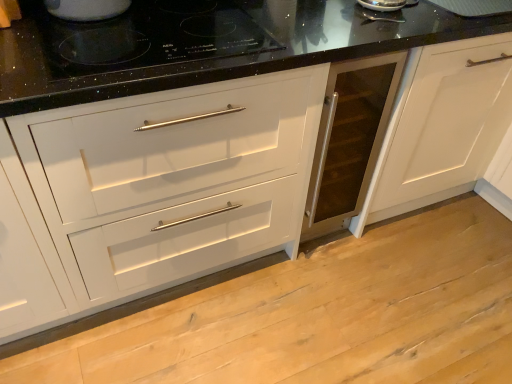
Question: Is black glass cooktop at upper center surrounding white glossy kettle at upper left?

Choices:
 (A) no
 (B) yes

Answer: (A)

Question: From the image's perspective, does black glass cooktop at upper center appear higher than white glossy kettle at upper left?

Choices:
 (A) no
 (B) yes

Answer: (A)

Question: Is black glass cooktop at upper center closer to camera compared to white glossy kettle at upper left?

Choices:
 (A) no
 (B) yes

Answer: (B)

Question: Is black glass cooktop at upper center behind white glossy kettle at upper left?

Choices:
 (A) no
 (B) yes

Answer: (A)

Question: Are black glass cooktop at upper center and white glossy kettle at upper left beside each other?

Choices:
 (A) yes
 (B) no

Answer: (B)

Question: Does black glass cooktop at upper center appear on the right side of white glossy kettle at upper left?

Choices:
 (A) no
 (B) yes

Answer: (B)

Question: Is white glossy kettle at upper left at the left side of black glass cooktop at upper center?

Choices:
 (A) yes
 (B) no

Answer: (A)

Question: From the image's perspective, is white glossy kettle at upper left beneath black glass cooktop at upper center?

Choices:
 (A) no
 (B) yes

Answer: (A)

Question: Is white glossy kettle at upper left positioned beyond the bounds of black glass cooktop at upper center?

Choices:
 (A) yes
 (B) no

Answer: (A)

Question: Is white glossy kettle at upper left taller than black glass cooktop at upper center?

Choices:
 (A) no
 (B) yes

Answer: (B)

Question: Is white glossy kettle at upper left positioned with its back to black glass cooktop at upper center?

Choices:
 (A) no
 (B) yes

Answer: (A)

Question: Is white glossy kettle at upper left thinner than black glass cooktop at upper center?

Choices:
 (A) yes
 (B) no

Answer: (A)

Question: From the image's perspective, relative to black glass cooktop at upper center, is white glossy kettle at upper left above or below?

Choices:
 (A) below
 (B) above

Answer: (B)